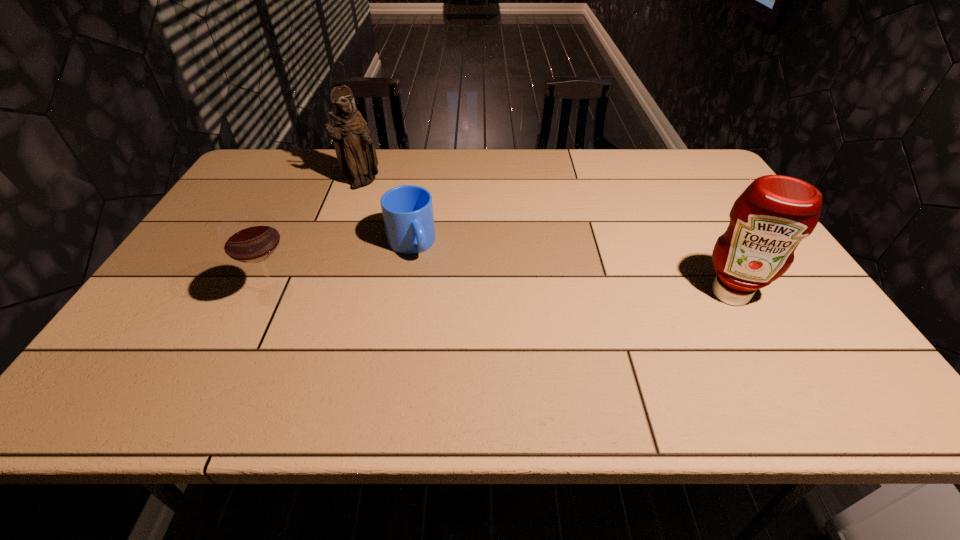
Locate an element on the screen. This screenshot has height=540, width=960. wineglass is located at coordinates (250, 237).

Where is `the rightmost object`? Image resolution: width=960 pixels, height=540 pixels. the rightmost object is located at coordinates (771, 217).

The image size is (960, 540). What are the coordinates of `the second farthest object` in the screenshot? It's located at (407, 210).

Find the location of a particular element. Image resolution: width=960 pixels, height=540 pixels. mug is located at coordinates [x=407, y=210].

Locate an element on the screen. This screenshot has width=960, height=540. the farthest object is located at coordinates (356, 154).

At what (x,y) coordinates should I click in order to perform the action: click on vacant point located 0.210m on the left of the third tallest object. Please return your answer as a coordinate pair (x, y). Looking at the image, I should click on (165, 294).

What are the coordinates of `vacant space located 0.080m on the left of the condiment` in the screenshot? It's located at (666, 294).

At what (x,y) coordinates should I click in order to perform the action: click on free space located on the side of the shortest object with the handle. Please return your answer as a coordinate pair (x, y). The width and height of the screenshot is (960, 540). Looking at the image, I should click on (448, 316).

I want to click on free spot located on the side of the shortest object with the handle, so click(428, 280).

I want to click on vacant area situated on the side of the shortest object with the handle, so click(x=469, y=354).